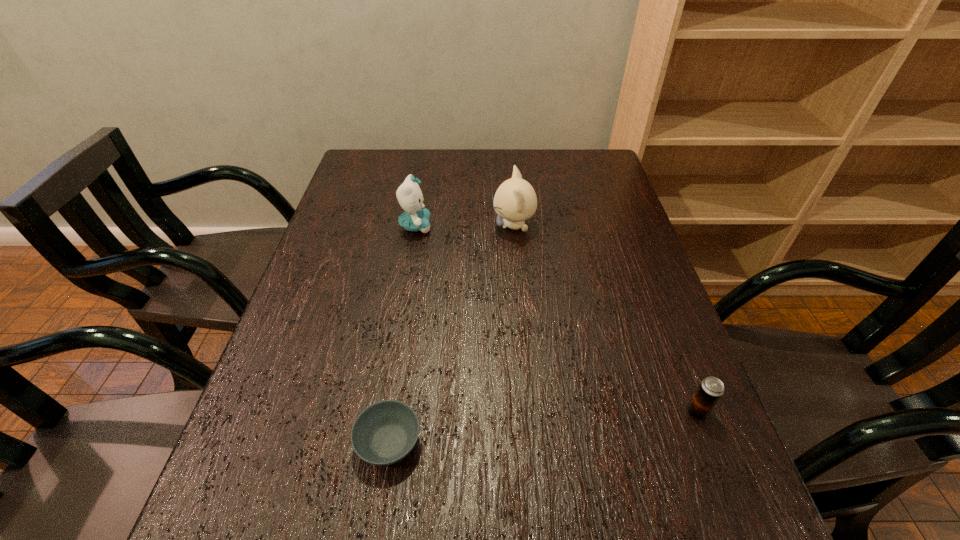
Where is `free space between the shortest object and the second shortest object`? This screenshot has width=960, height=540. free space between the shortest object and the second shortest object is located at coordinates (543, 427).

You are a GUI agent. You are given a task and a screenshot of the screen. Output one action in this format:
    pyautogui.click(x=<x>, y=<y>)
    Task: Click on the free space between the left kitten and the beer can
    The width and height of the screenshot is (960, 540).
    Given the screenshot: What is the action you would take?
    pyautogui.click(x=556, y=319)

The height and width of the screenshot is (540, 960). What are the coordinates of `vacant region between the beer can and the left kitten` in the screenshot? It's located at (556, 319).

Locate an element on the screen. The width and height of the screenshot is (960, 540). free spot between the left kitten and the third object from left to right is located at coordinates (465, 226).

Find the location of a particular element. empty space between the third tallest object and the right kitten is located at coordinates (606, 319).

Find the location of a particular element. The image size is (960, 540). empty space between the soup bowl and the beer can is located at coordinates (543, 427).

The height and width of the screenshot is (540, 960). Find the location of `empty location between the third object from left to right and the left kitten`. empty location between the third object from left to right and the left kitten is located at coordinates (465, 226).

Locate an element on the screen. This screenshot has height=540, width=960. vacant region between the left kitten and the rightmost object is located at coordinates (556, 319).

The image size is (960, 540). I want to click on object that is the closest to the soup bowl, so click(711, 389).

The image size is (960, 540). I want to click on object that is the closest to the soup bowl, so click(711, 389).